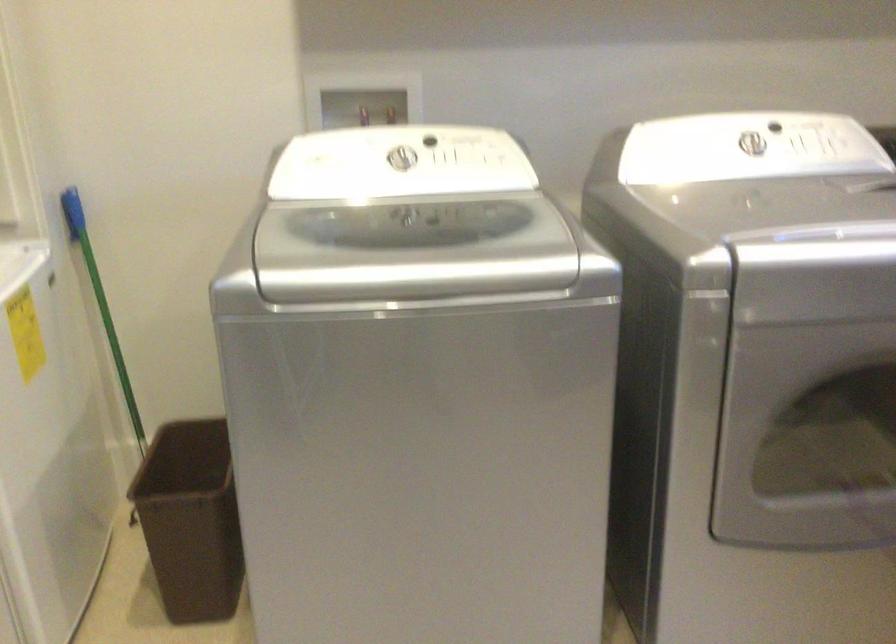
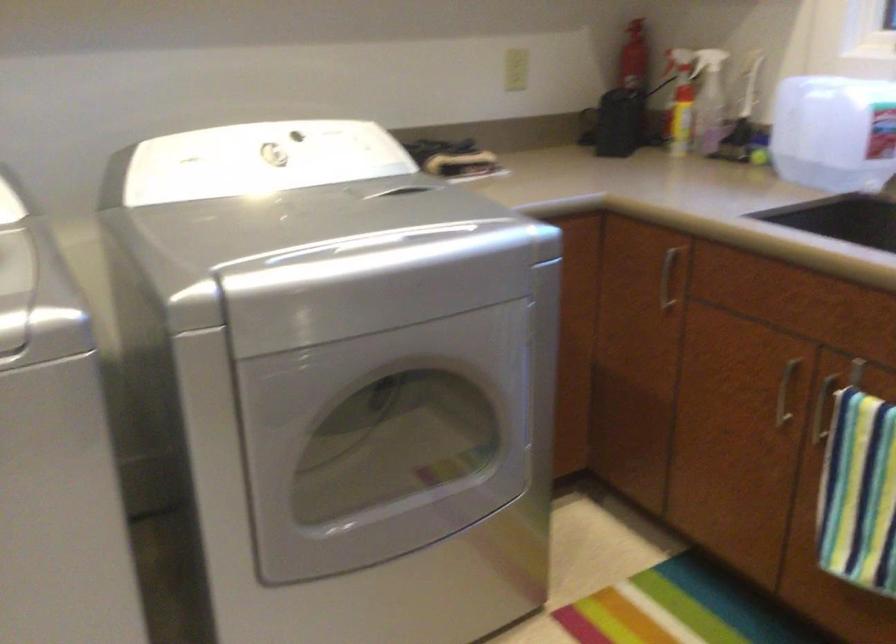
Question: The camera is either moving clockwise (left) or counter-clockwise (right) around the object. The first image is from the beginning of the video and the second image is from the end. Is the camera moving left or right when shooting the video?

Choices:
 (A) Left
 (B) Right

Answer: (A)